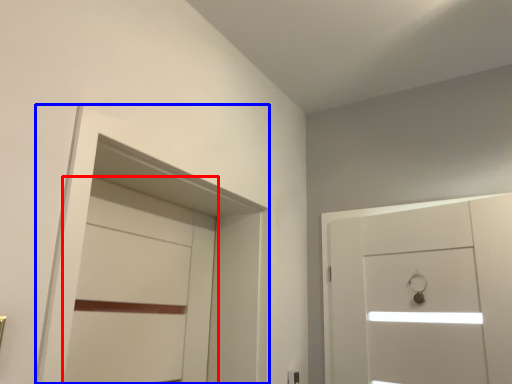
Question: Among these objects, which one is farthest to the camera, door (highlighted by a red box) or locker (highlighted by a blue box)?

Choices:
 (A) door
 (B) locker

Answer: (A)